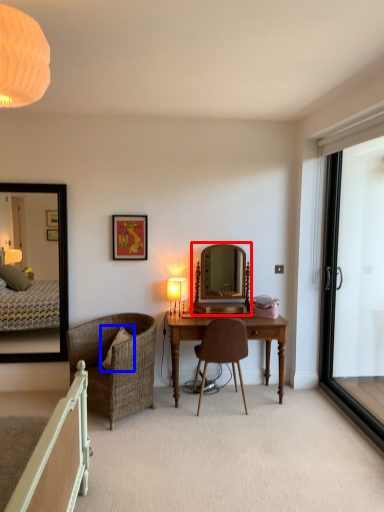
Question: Which of the following is the farthest to the observer, mirror (highlighted by a red box) or pillow (highlighted by a blue box)?

Choices:
 (A) mirror
 (B) pillow

Answer: (A)